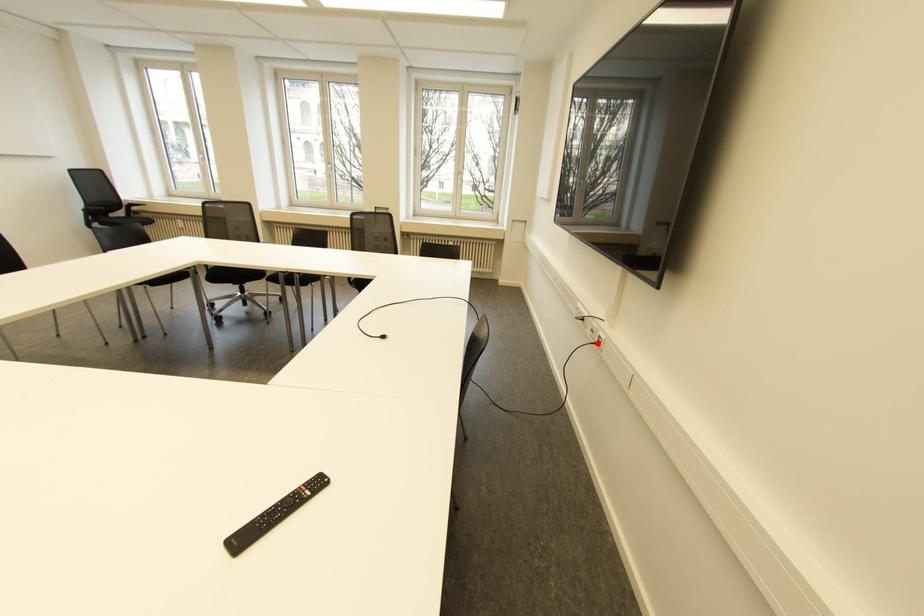
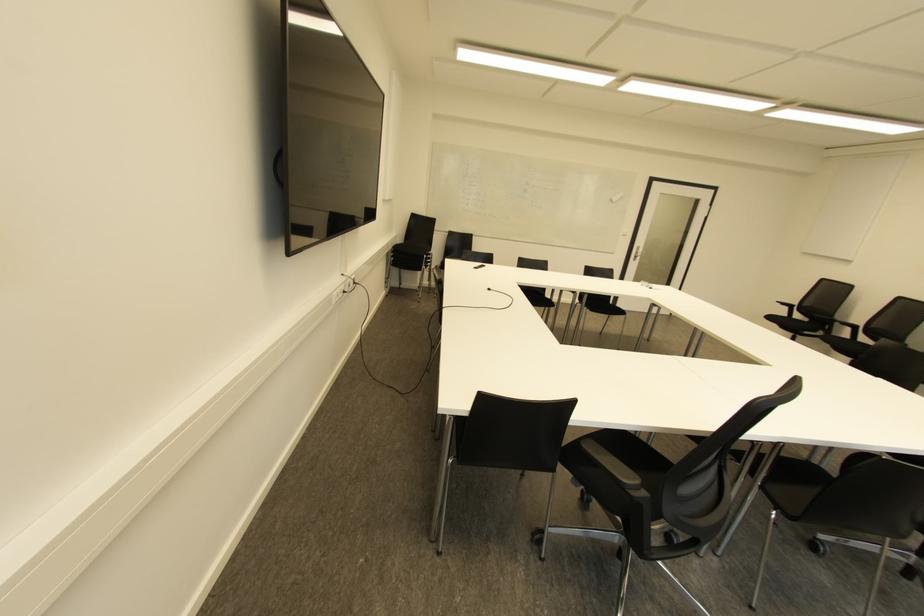
Where in the second image is the point corresponding to the highlighted location from the first image?

(354, 282)